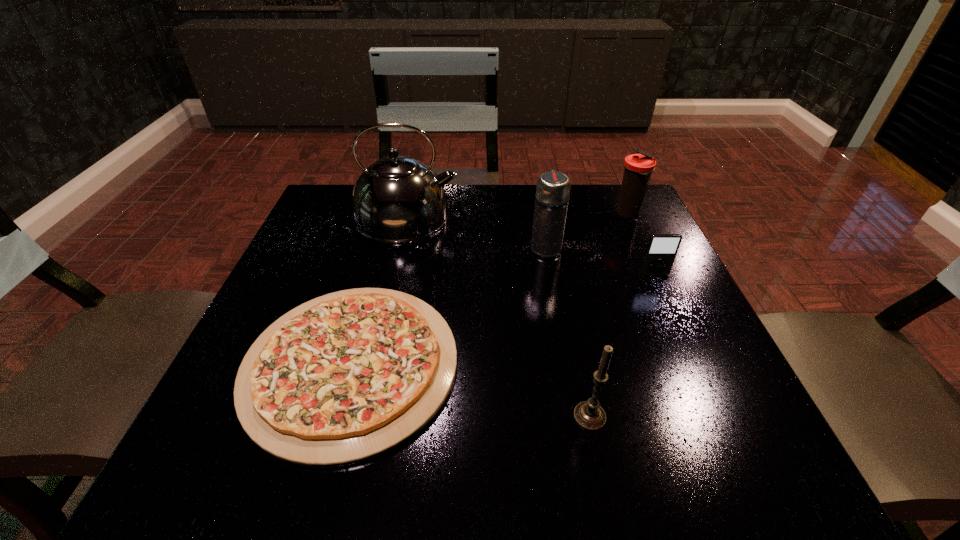
Locate an element on the screen. The image size is (960, 540). vacant space situated with a handle on the side of the nearer thermos bottle is located at coordinates (541, 224).

The width and height of the screenshot is (960, 540). Find the location of `free location located on the front of the farther thermos bottle`. free location located on the front of the farther thermos bottle is located at coordinates (663, 290).

Find the location of a particular element. The width and height of the screenshot is (960, 540). vacant space situated on the back of the candle is located at coordinates (558, 263).

Image resolution: width=960 pixels, height=540 pixels. Identify the location of free location located on the front-facing side of the iPod. tap(681, 333).

At what (x,y) coordinates should I click in order to perform the action: click on vacant space situated 0.390m on the right of the shortest object. Please return your answer as a coordinate pair (x, y). Looking at the image, I should click on (684, 364).

Where is `kettle present at the far edge`? The width and height of the screenshot is (960, 540). kettle present at the far edge is located at coordinates (397, 199).

The width and height of the screenshot is (960, 540). In order to click on candle present at the near edge in this screenshot , I will do `click(589, 414)`.

At what (x,y) coordinates should I click in order to perform the action: click on pizza at the near edge. Please return your answer as a coordinate pair (x, y). Looking at the image, I should click on coord(348,376).

Find the location of a particular element. This screenshot has height=540, width=960. kettle situated at the left edge is located at coordinates (397, 199).

Where is `pizza that is at the left edge`? Image resolution: width=960 pixels, height=540 pixels. pizza that is at the left edge is located at coordinates (348, 376).